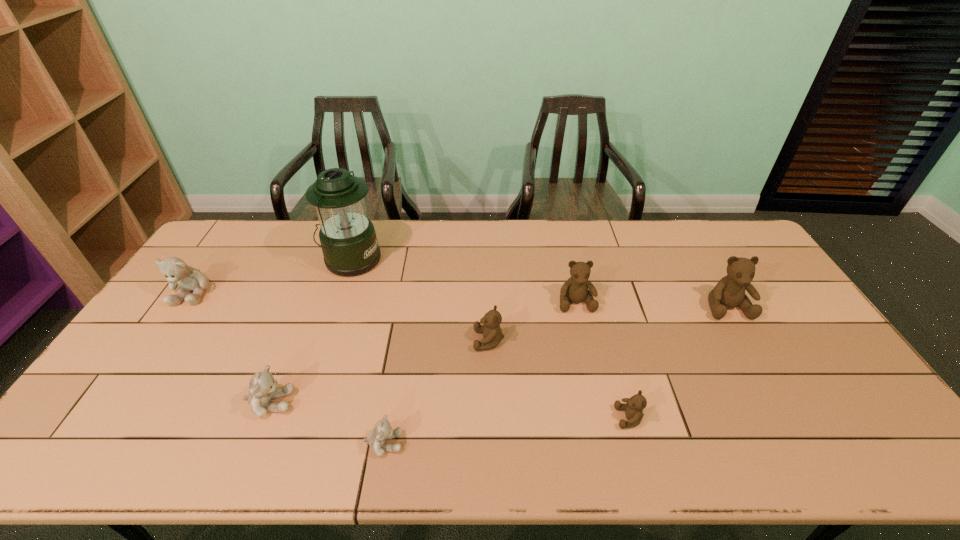
Image resolution: width=960 pixels, height=540 pixels. What are the coordinates of `the second biggest gray teddy bear` in the screenshot? It's located at (263, 388).

The height and width of the screenshot is (540, 960). What are the coordinates of `the nearest brown teddy bear` in the screenshot? It's located at (633, 407).

You are a GUI agent. You are given a task and a screenshot of the screen. Output one action in this format:
    pyautogui.click(x=<x>, y=<y>)
    Task: Click on the smallest gray teddy bear
    
    Given the screenshot: What is the action you would take?
    pyautogui.click(x=382, y=431)

Where is `the rightmost gray teddy bear`? This screenshot has height=540, width=960. the rightmost gray teddy bear is located at coordinates (382, 431).

At what (x,y) coordinates should I click in order to perform the action: click on vacant space located 0.090m on the front of the lantern. Please return your answer as a coordinate pair (x, y). The image size is (960, 540). Looking at the image, I should click on (338, 298).

Where is `vacant space located 0.110m on the front-facing side of the tallest teddy bear`? This screenshot has height=540, width=960. vacant space located 0.110m on the front-facing side of the tallest teddy bear is located at coordinates (752, 352).

You are a GUI agent. You are given a task and a screenshot of the screen. Output one action in this format:
    pyautogui.click(x=<x>, y=<y>)
    Task: Click on the blank space located on the front-facing side of the second biggest brown teddy bear
    Image resolution: width=960 pixels, height=540 pixels.
    Given the screenshot: What is the action you would take?
    pyautogui.click(x=586, y=348)

Where is `free spot located on the face of the leftmost teddy bear`? This screenshot has width=960, height=540. free spot located on the face of the leftmost teddy bear is located at coordinates (171, 324).

Image resolution: width=960 pixels, height=540 pixels. Identify the location of vacant space located 0.240m on the front-facing side of the fourth farthest teddy bear. (390, 340).

Where is `free region located on the front-facing side of the fourth farthest teddy bear`? This screenshot has width=960, height=540. free region located on the front-facing side of the fourth farthest teddy bear is located at coordinates (421, 340).